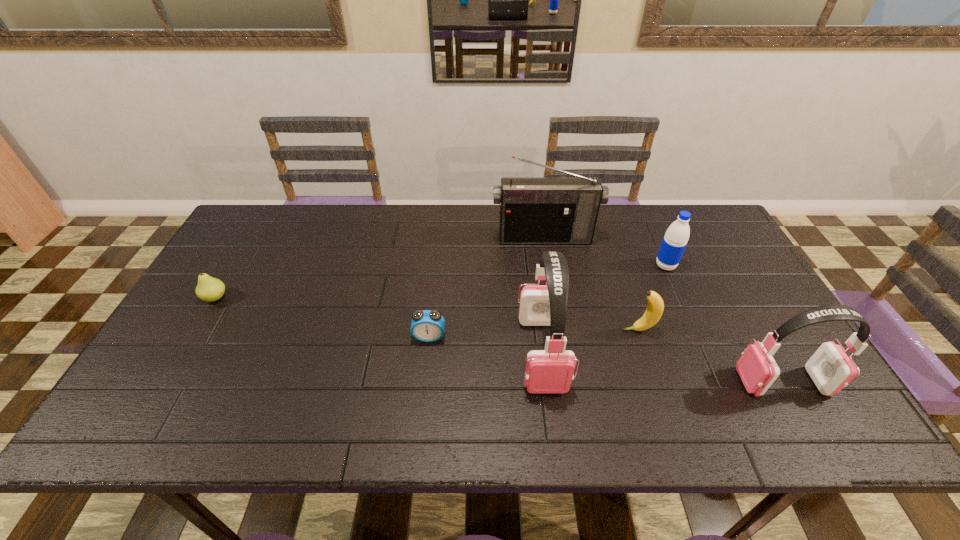
This screenshot has height=540, width=960. I want to click on free space between the alarm clock and the shorter earphone, so click(x=606, y=360).

The width and height of the screenshot is (960, 540). I want to click on vacant space that's between the farthest object and the second farthest object, so click(605, 252).

Where is `free area in between the third farthest object and the sixth nearest object`? This screenshot has height=540, width=960. free area in between the third farthest object and the sixth nearest object is located at coordinates (441, 282).

Find the location of a particular element. The image size is (960, 540). free space that is in between the radio receiver and the pear is located at coordinates (380, 268).

This screenshot has width=960, height=540. Find the location of `vacant area that lies between the alarm clock and the fifth tallest object`. vacant area that lies between the alarm clock and the fifth tallest object is located at coordinates (534, 334).

This screenshot has height=540, width=960. I want to click on object that can be found as the second closest to the alarm clock, so click(533, 210).

The width and height of the screenshot is (960, 540). In order to click on the fifth closest object to the shorter earphone in this screenshot , I will do `click(427, 326)`.

The width and height of the screenshot is (960, 540). I want to click on free space that satisfies the following two spatial constraints: 1. from the stem of the banana; 2. on the outer surface of the left earphone, so click(646, 353).